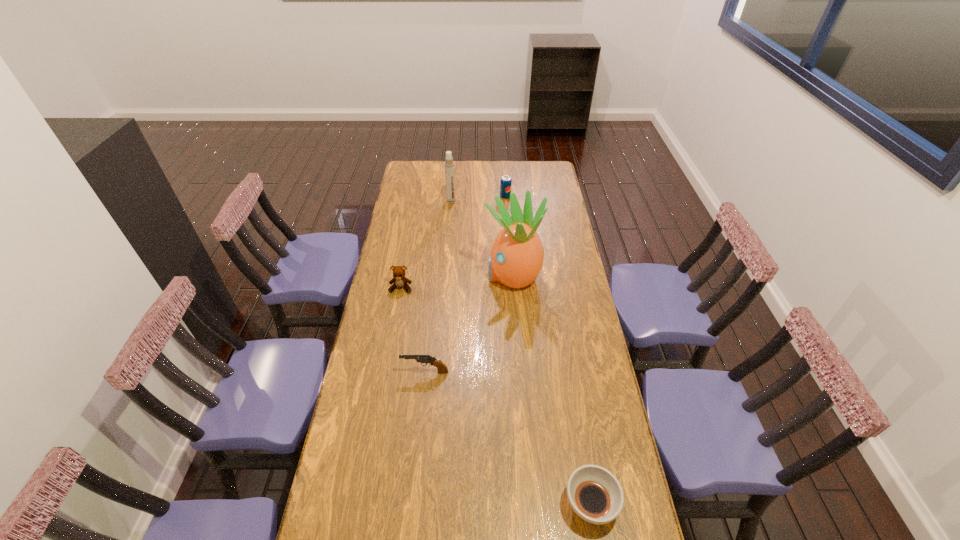
Image resolution: width=960 pixels, height=540 pixels. I want to click on free space at the far edge of the desktop, so click(x=525, y=177).

The image size is (960, 540). In the image, there is a desktop. Find the location of `free space at the left edge`. free space at the left edge is located at coordinates (417, 185).

The height and width of the screenshot is (540, 960). What are the coordinates of `vacant space at the right edge` in the screenshot? It's located at (585, 377).

Where is `free space at the far right corner of the desktop`? This screenshot has height=540, width=960. free space at the far right corner of the desktop is located at coordinates (531, 179).

Find the location of a particular element. vacant point located between the leftmost object and the fifth farthest object is located at coordinates (413, 330).

Where is `vacant space in between the fifth farthest object and the aerosol can`? The height and width of the screenshot is (540, 960). vacant space in between the fifth farthest object and the aerosol can is located at coordinates (438, 286).

This screenshot has height=540, width=960. I want to click on vacant region between the pop soda and the teddy bear, so click(453, 242).

Identify the location of blank region between the leftmost object and the second nearest object. The height and width of the screenshot is (540, 960). (413, 330).

Image resolution: width=960 pixels, height=540 pixels. Identify the location of vacant region between the nearest object and the teddy bear. (495, 396).

Locate an element on the screen. This screenshot has height=540, width=960. vacant area that lies between the pop soda and the teddy bear is located at coordinates (453, 242).